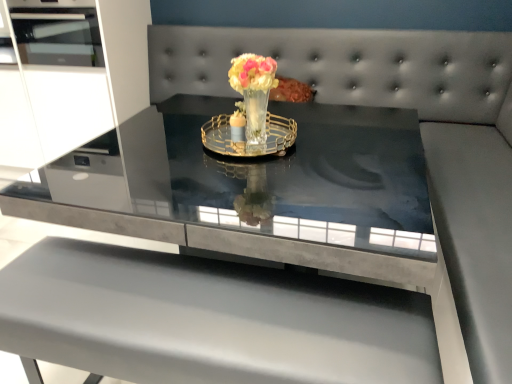
You are a GUI agent. You are given a task and a screenshot of the screen. Output one action in this format:
    pyautogui.click(x=<x>, y=<y>)
    Task: Click on the free location in front of gold metallic tray at center
    
    Given the screenshot: What is the action you would take?
    pyautogui.click(x=249, y=183)